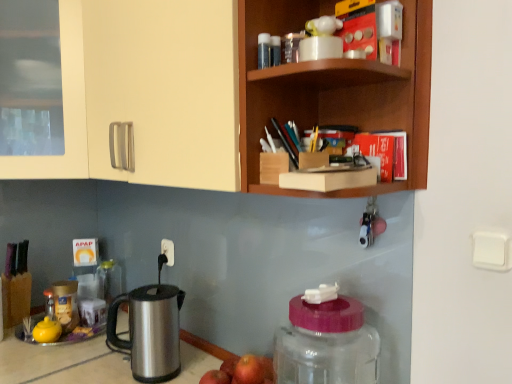
Question: Can you confirm if transparent plastic bottle at upper center, placed as the first bottle when sorted from top to bottom, is positioned to the left of white plastic light switch at upper right?

Choices:
 (A) yes
 (B) no

Answer: (A)

Question: Does transparent plastic bottle at upper center, placed as the first bottle when sorted from top to bottom, contain white plastic light switch at upper right?

Choices:
 (A) no
 (B) yes

Answer: (A)

Question: Considering the relative sizes of transparent plastic bottle at upper center, positioned as the second bottle in left-to-right order, and white plastic light switch at upper right in the image provided, is transparent plastic bottle at upper center, positioned as the second bottle in left-to-right order, bigger than white plastic light switch at upper right?

Choices:
 (A) yes
 (B) no

Answer: (A)

Question: Is transparent plastic bottle at upper center, placed as the first bottle when sorted from top to bottom, next to white plastic light switch at upper right?

Choices:
 (A) no
 (B) yes

Answer: (A)

Question: From the image's perspective, is transparent plastic bottle at upper center, positioned as the 2th bottle in front-to-back order, over white plastic light switch at upper right?

Choices:
 (A) no
 (B) yes

Answer: (B)

Question: Is matte cream cabinet at upper left bigger or smaller than wooden shelf at upper right?

Choices:
 (A) big
 (B) small

Answer: (A)

Question: From the image's perspective, relative to wooden shelf at upper right, is matte cream cabinet at upper left above or below?

Choices:
 (A) below
 (B) above

Answer: (B)

Question: From a real-world perspective, relative to wooden shelf at upper right, is matte cream cabinet at upper left vertically above or below?

Choices:
 (A) above
 (B) below

Answer: (A)

Question: From their relative heights in the image, would you say matte cream cabinet at upper left is taller or shorter than wooden shelf at upper right?

Choices:
 (A) tall
 (B) short

Answer: (A)

Question: Considering the positions of transparent plastic bottle at upper center, the 2th bottle in the right-to-left sequence, and wooden shelf at upper right in the image, is transparent plastic bottle at upper center, the 2th bottle in the right-to-left sequence, taller or shorter than wooden shelf at upper right?

Choices:
 (A) tall
 (B) short

Answer: (B)

Question: Does point (265, 56) appear closer or farther from the camera than point (417, 89)?

Choices:
 (A) closer
 (B) farther

Answer: (A)

Question: Is transparent plastic bottle at upper center, positioned as the 2th bottle in front-to-back order, wider or thinner than wooden shelf at upper right?

Choices:
 (A) wide
 (B) thin

Answer: (B)

Question: Would you say transparent plastic bottle at upper center, the 2th bottle in the right-to-left sequence, is inside or outside wooden shelf at upper right?

Choices:
 (A) inside
 (B) outside

Answer: (A)

Question: From a real-world perspective, is transparent plastic bottle at upper center, placed as the first bottle when sorted from top to bottom, above or below matte cream cabinet at upper left?

Choices:
 (A) above
 (B) below

Answer: (B)

Question: Based on their positions, is transparent plastic bottle at upper center, the 2th bottle in the right-to-left sequence, located to the left or right of matte cream cabinet at upper left?

Choices:
 (A) left
 (B) right

Answer: (B)